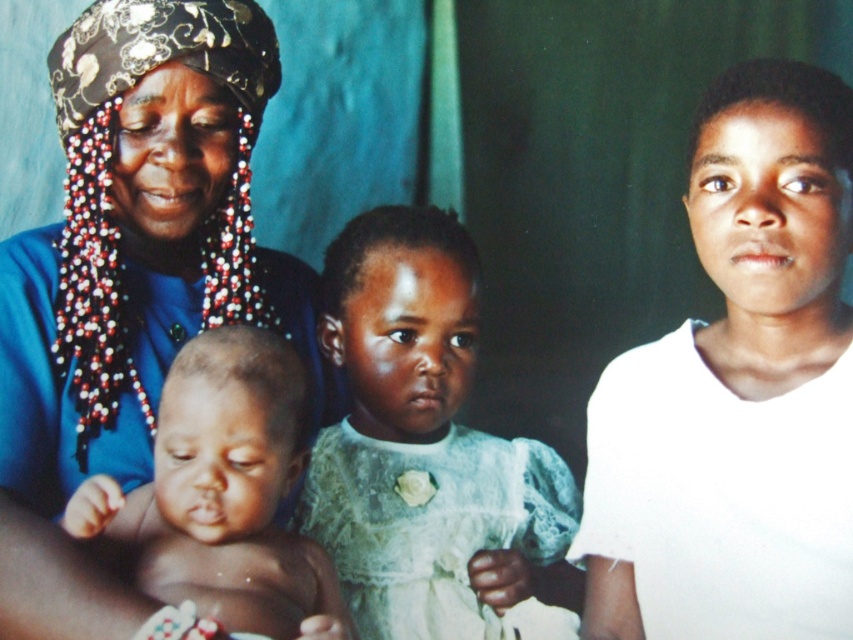
Based on the photo, you are a photographer standing in front of the scene. You want to take a closeup shot of the matte blue dress at center without moving the subjects. Can you move closer to the dress to get a better shot? Please explain your reasoning.

The matte blue dress at center is 34.84 inches away from the viewer. Since this distance allows for a closeup shot with most camera lenses, you can move closer to the dress to get a better shot as long as the camera can focus at that distance.

You are an interior designer analyzing the composition of this family portrait. The scene includes an older woman in a blue top holding two children, and there is a matte blue dress at center. Based on their positions, which object is closer to the center of the image?

The matte blue dress at center is located at point (126, 280), which is very close to the center coordinates of the image. Therefore, the matte blue dress at center is the closest to the center of the image.